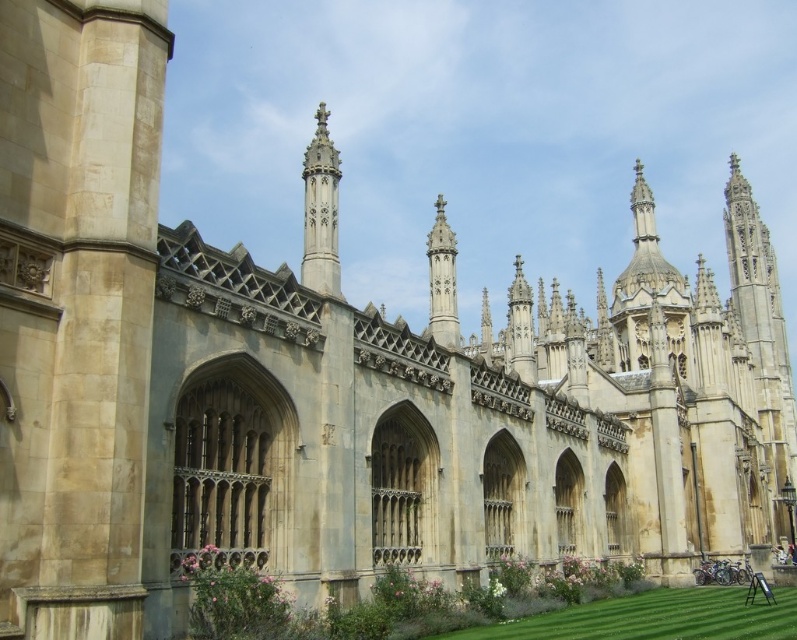
Who is higher up, stone gothic tower at center or polished stone spire at center?

stone gothic tower at center

Can you confirm if stone gothic tower at center is positioned to the right of polished stone spire at center?

Correct, you'll find stone gothic tower at center to the right of polished stone spire at center.

Is point (731, 208) farther from viewer compared to point (444, 282)?

Yes, it is.

You are a GUI agent. You are given a task and a screenshot of the screen. Output one action in this format:
    pyautogui.click(x=<x>, y=<y>)
    Task: Click on the stone gothic tower at center
    This screenshot has width=797, height=640.
    Given the screenshot: What is the action you would take?
    click(762, 337)

Between stone gothic tower at center and white stone spire at upper center, which one has more height?

stone gothic tower at center is taller.

In the scene shown: Is stone gothic tower at center to the left of white stone spire at upper center from the viewer's perspective?

No, stone gothic tower at center is not to the left of white stone spire at upper center.

You are a GUI agent. You are given a task and a screenshot of the screen. Output one action in this format:
    pyautogui.click(x=<x>, y=<y>)
    Task: Click on the stone gothic tower at center
    The image size is (797, 640).
    Given the screenshot: What is the action you would take?
    pyautogui.click(x=762, y=337)

Between green lawn at lower center and polished stone spire at center, which one is positioned lower?

green lawn at lower center

Is green lawn at lower center shorter than polished stone spire at center?

Yes, green lawn at lower center is shorter than polished stone spire at center.

Identify the location of green lawn at lower center. The width and height of the screenshot is (797, 640). (654, 618).

The image size is (797, 640). In order to click on green lawn at lower center in this screenshot , I will do `click(654, 618)`.